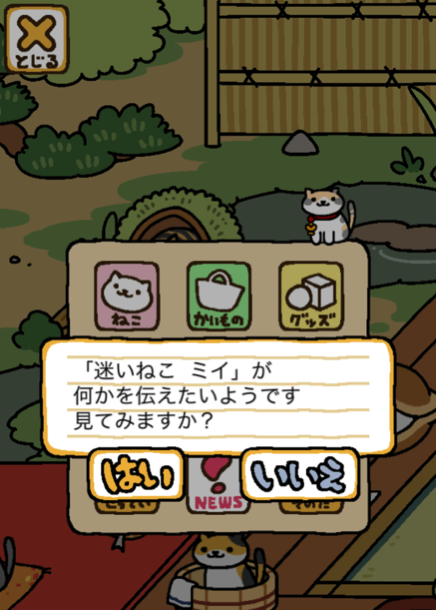
Identify the location of basket for cat. (235, 596).